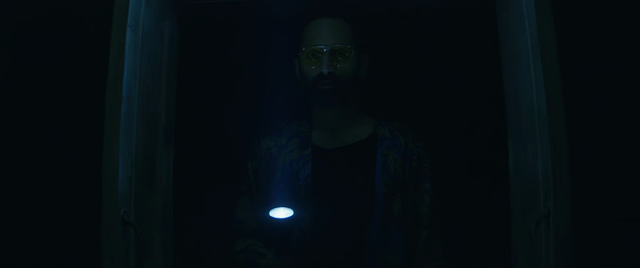
Identify the location of door frame. The height and width of the screenshot is (268, 640). (559, 190).